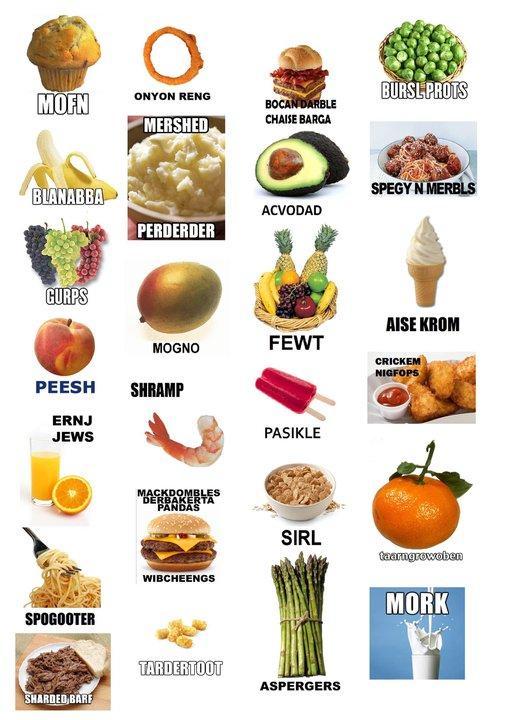
This screenshot has width=505, height=720. What are the coordinates of `column 2` in the screenshot? It's located at (163, 13).